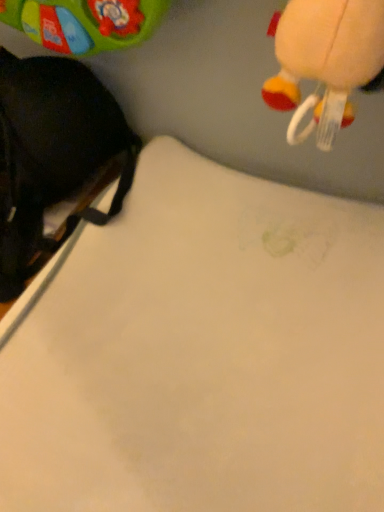
Question: Is white matte sheet at center taller or shorter than black fabric backpack at left?

Choices:
 (A) short
 (B) tall

Answer: (A)

Question: From a real-world perspective, is white matte sheet at center positioned above or below black fabric backpack at left?

Choices:
 (A) above
 (B) below

Answer: (B)

Question: Considering their positions, is white matte sheet at center located in front of or behind black fabric backpack at left?

Choices:
 (A) behind
 (B) front

Answer: (B)

Question: From the image's perspective, relative to white matte sheet at center, is black fabric backpack at left above or below?

Choices:
 (A) below
 (B) above

Answer: (B)

Question: Is black fabric backpack at left taller or shorter than white matte sheet at center?

Choices:
 (A) tall
 (B) short

Answer: (A)

Question: Considering the positions of black fabric backpack at left and white matte sheet at center in the image, is black fabric backpack at left wider or thinner than white matte sheet at center?

Choices:
 (A) wide
 (B) thin

Answer: (B)

Question: Based on their positions, is black fabric backpack at left located to the left or right of white matte sheet at center?

Choices:
 (A) right
 (B) left

Answer: (B)